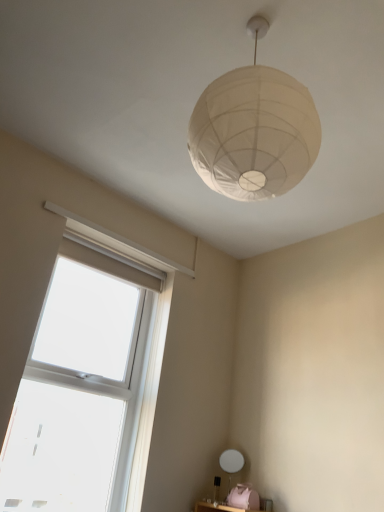
Question: Is point (228, 459) positioned closer to the camera than point (225, 136)?

Choices:
 (A) farther
 (B) closer

Answer: (A)

Question: In terms of width, does white matte table lamp at lower center look wider or thinner when compared to white paper lampshade at upper center?

Choices:
 (A) wide
 (B) thin

Answer: (B)

Question: Which object is the farthest from the clear glass window at lower left?

Choices:
 (A) white matte table lamp at lower center
 (B) white paper lampshade at upper center

Answer: (B)

Question: Based on their relative distances, which object is nearer to the white paper lampshade at upper center?

Choices:
 (A) clear glass window at lower left
 (B) white matte table lamp at lower center

Answer: (A)